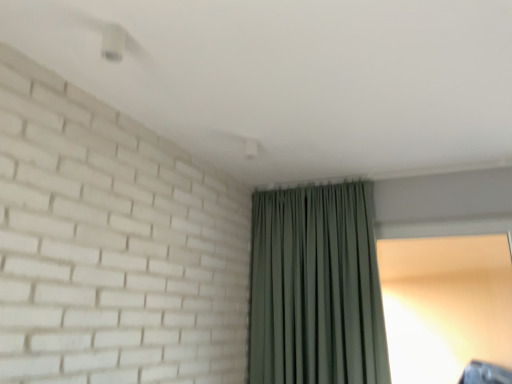
Question: Is green fabric curtain at center wider or thinner than transparent glass window at right?

Choices:
 (A) thin
 (B) wide

Answer: (B)

Question: Considering their positions, is green fabric curtain at center located in front of or behind transparent glass window at right?

Choices:
 (A) behind
 (B) front

Answer: (B)

Question: Choose the correct answer: Is green fabric curtain at center inside transparent glass window at right or outside it?

Choices:
 (A) inside
 (B) outside

Answer: (B)

Question: Does point (493, 357) appear closer or farther from the camera than point (266, 344)?

Choices:
 (A) farther
 (B) closer

Answer: (B)

Question: Is transparent glass window at right bigger or smaller than green fabric curtain at center?

Choices:
 (A) big
 (B) small

Answer: (B)

Question: Relative to green fabric curtain at center, is transparent glass window at right in front or behind?

Choices:
 (A) front
 (B) behind

Answer: (B)

Question: From the image's perspective, is transparent glass window at right positioned above or below green fabric curtain at center?

Choices:
 (A) below
 (B) above

Answer: (A)